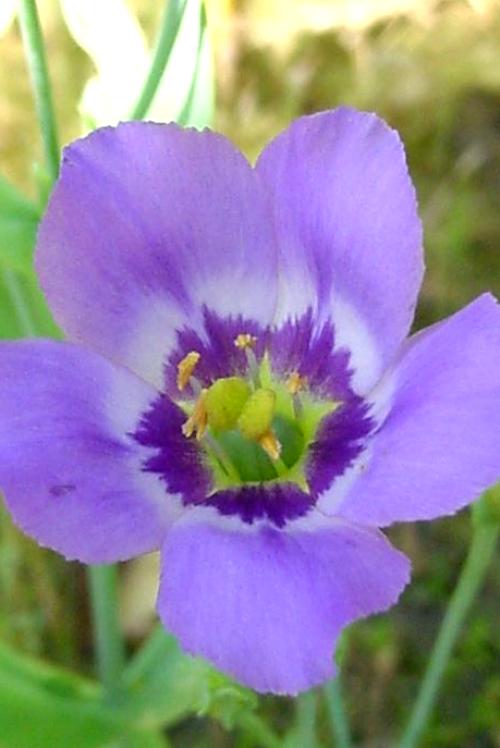
Locate an element on the screen. This screenshot has height=748, width=500. white light is located at coordinates (113, 95).